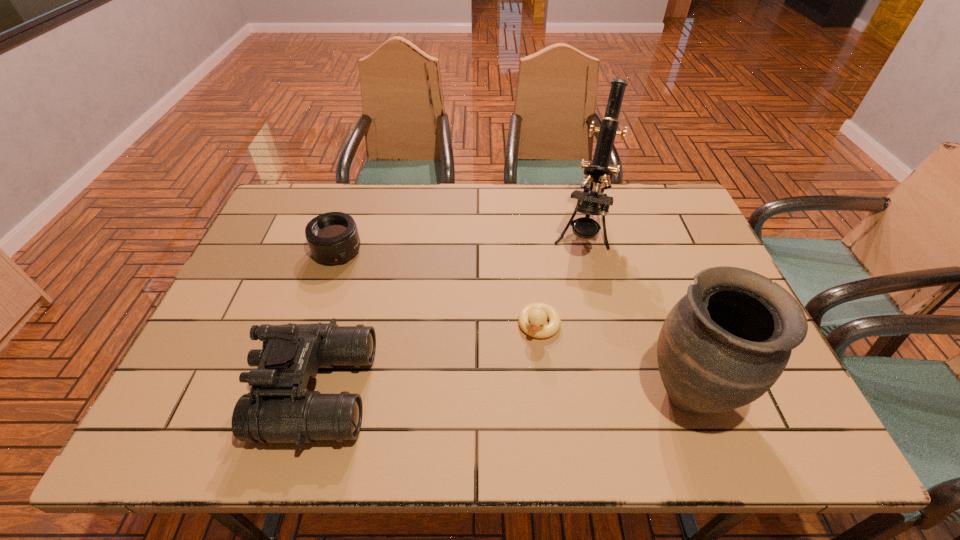
Locate an element on the screen. the third shortest object is located at coordinates (279, 408).

The height and width of the screenshot is (540, 960). I want to click on urn, so click(x=724, y=344).

Identify the location of microscope. This screenshot has height=540, width=960. (599, 172).

Image resolution: width=960 pixels, height=540 pixels. In order to click on telephoto lens in this screenshot , I will do `click(333, 237)`.

What are the coordinates of `the third object from left to right` in the screenshot? It's located at (532, 318).

The height and width of the screenshot is (540, 960). In order to click on vacant position located through the lenses of the third shortest object in this screenshot , I will do `click(235, 391)`.

You are a GUI agent. You are given a task and a screenshot of the screen. Output one action in this format:
    pyautogui.click(x=<x>, y=<y>)
    Task: Click on the vacant space located 0.150m through the lenses of the third shortest object
    The height and width of the screenshot is (540, 960).
    Given the screenshot: What is the action you would take?
    pyautogui.click(x=200, y=391)

Find the location of a particular element. vacant space positioned through the lenses of the third shortest object is located at coordinates (204, 391).

You are a GUI agent. You are given a task and a screenshot of the screen. Output one action in this format:
    pyautogui.click(x=<x>, y=<y>)
    Task: Click on the vacant space located 0.300m on the left of the urn
    This screenshot has height=540, width=960.
    Given the screenshot: What is the action you would take?
    pyautogui.click(x=507, y=393)

The height and width of the screenshot is (540, 960). I want to click on free space located 0.200m through the eyepiece of the microscope, so tap(566, 314).